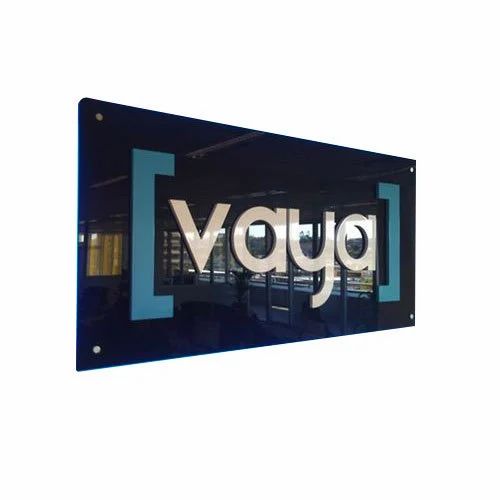
I want to click on floor, so click(x=179, y=348).